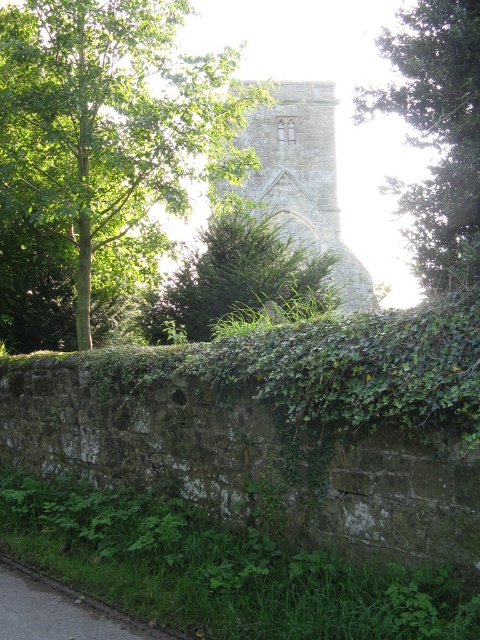
You are standing in front of the stone wall and want to walk towards the green leafy tree at upper center. Which direction should you walk to avoid the green leafy tree at left?

To reach the green leafy tree at upper center while avoiding the green leafy tree at left, you should walk towards the right side, as the green leafy tree at left is positioned under the green leafy tree at upper center, meaning it is directly in front of it from your perspective. By moving to the right, you can bypass the tree on the left and head toward the upper center tree.

You are standing in front of the stone wall covered in green ivy and vegetation. You notice two points marked in the scene. Based on your position, which point is closer to you, point at coordinates (276, 285) or point at coordinates (82, 605)?

Point at coordinates (82, 605) is closer to you since it is in front of point at coordinates (276, 285) according to the description.

You are standing in front of the stone wall and want to walk towards the point that is closer to you. Which point should you head towards, point (215, 100) or point (192, 328)?

You should head towards point (192, 328) because it is closer to you than point (215, 100), which is further away.